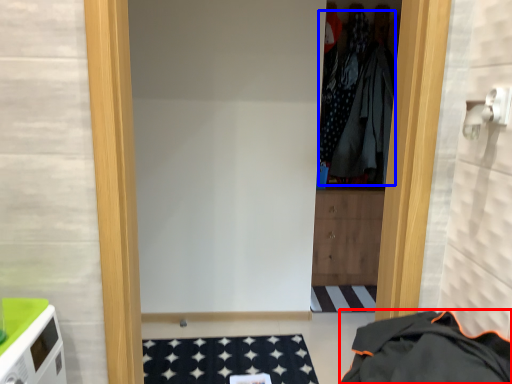
Question: Among these objects, which one is nearest to the camera, clothing (highlighted by a red box) or clothing (highlighted by a blue box)?

Choices:
 (A) clothing
 (B) clothing

Answer: (A)